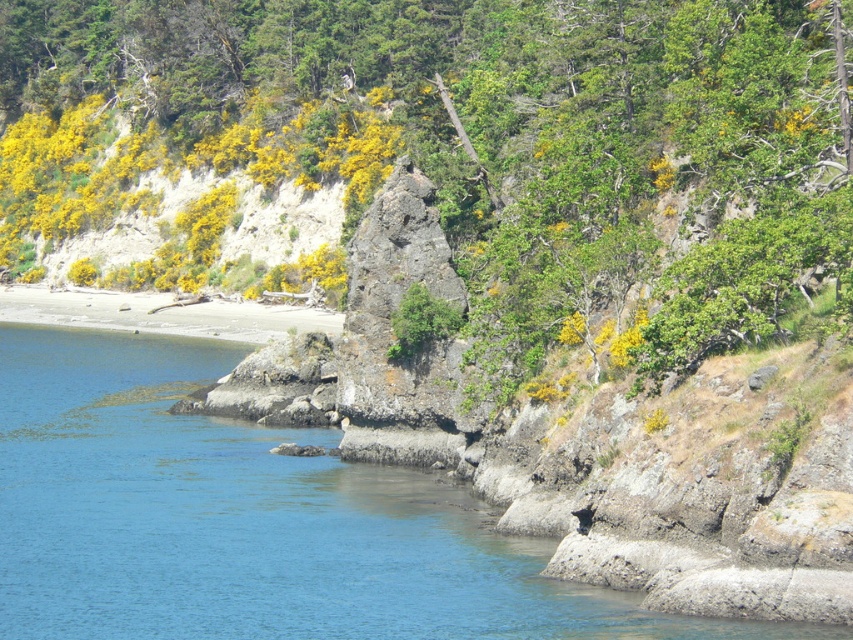
Which is behind, point (753, 257) or point (286, 326)?

Point (286, 326)

Is green leafy tree at center positioned before sandy beach at lower left?

That is True.

Is point (824, 65) positioned behind point (332, 328)?

That is False.

Where is `green leafy tree at center`? green leafy tree at center is located at coordinates (465, 138).

Can you confirm if clear blue water at lower left is shorter than sandy beach at lower left?

No, clear blue water at lower left is not shorter than sandy beach at lower left.

Is point (357, 500) closer to camera compared to point (18, 316)?

Yes, point (357, 500) is closer to viewer.

Identify the location of clear blue water at lower left. (251, 520).

Between green leafy tree at center and clear blue water at lower left, which one appears on the right side from the viewer's perspective?

green leafy tree at center is more to the right.

Which is behind, point (245, 102) or point (126, 339)?

The point (245, 102) is behind.

Locate an element on the screen. The image size is (853, 640). green leafy tree at center is located at coordinates (465, 138).